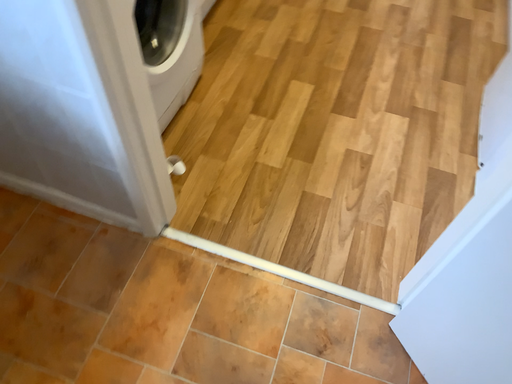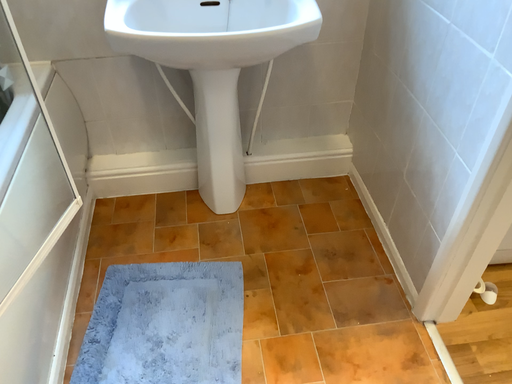
Question: How did the camera likely rotate when shooting the video?

Choices:
 (A) rotated left
 (B) rotated right

Answer: (A)